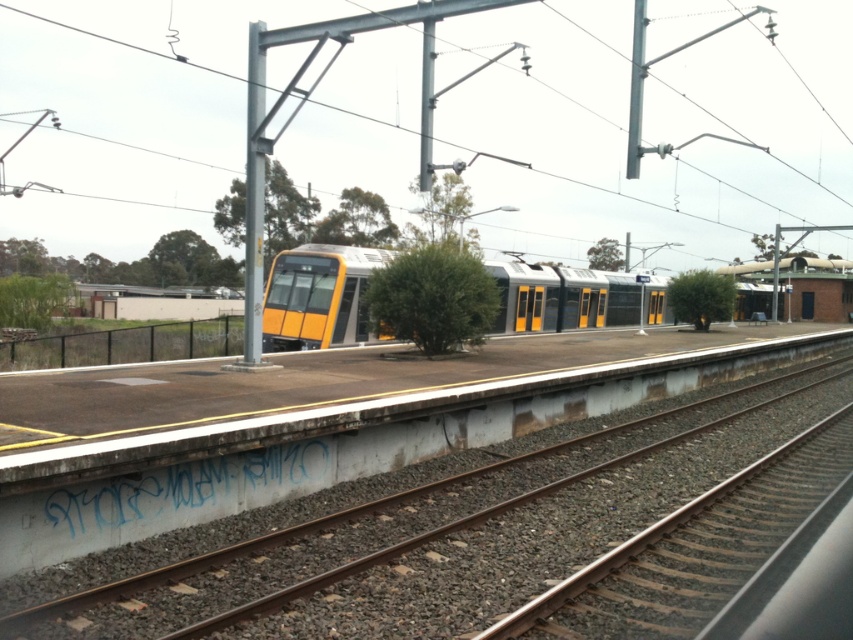
Question: Is metallic gray power line at upper center to the left of yellow matte train at center from the viewer's perspective?

Choices:
 (A) no
 (B) yes

Answer: (B)

Question: Which object is closer to the camera taking this photo?

Choices:
 (A) metallic gray power line at upper center
 (B) smooth concrete track at center

Answer: (B)

Question: Which of the following is the closest to the observer?

Choices:
 (A) smooth concrete track at center
 (B) yellow matte train at center
 (C) metallic gray power line at upper center

Answer: (A)

Question: Which of the following is the closest to the observer?

Choices:
 (A) yellow matte train at center
 (B) smooth concrete track at center
 (C) metallic gray power line at upper center

Answer: (B)

Question: Can you confirm if smooth concrete track at center is positioned to the right of yellow matte train at center?

Choices:
 (A) no
 (B) yes

Answer: (A)

Question: Does metallic gray power line at upper center have a greater width compared to smooth concrete track at center?

Choices:
 (A) no
 (B) yes

Answer: (B)